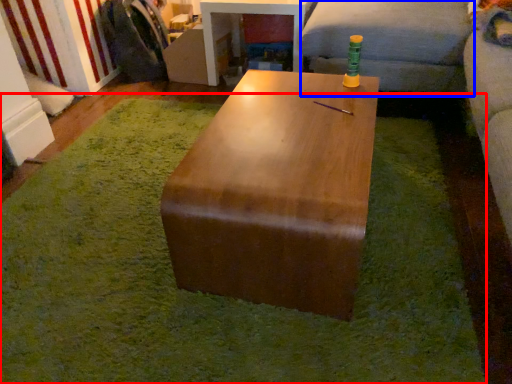
Question: Which of the following is the farthest to the observer, mat (highlighted by a red box) or couch (highlighted by a blue box)?

Choices:
 (A) mat
 (B) couch

Answer: (B)